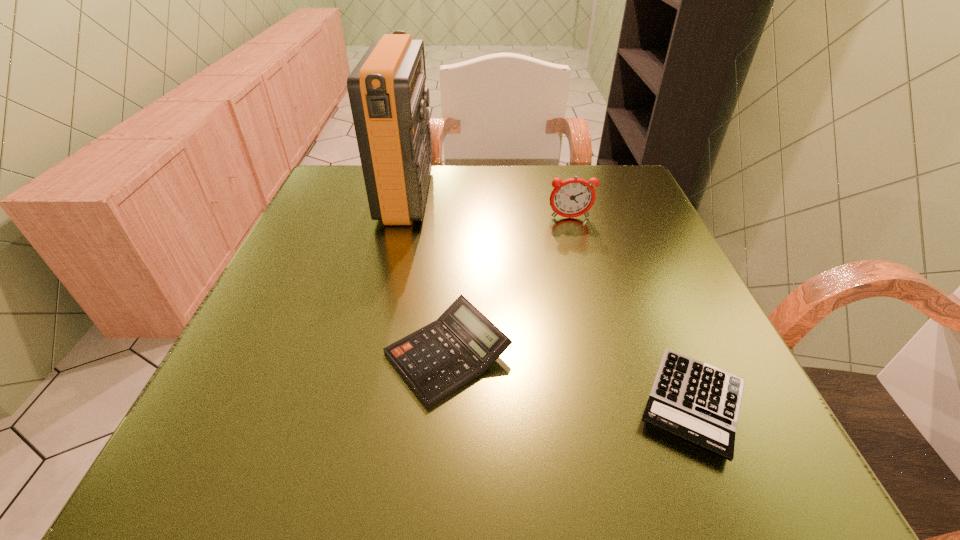
The image size is (960, 540). I want to click on radio receiver present at the far edge, so click(x=388, y=98).

Identify the location of alarm clock at the far edge. (573, 197).

I want to click on object that is at the near edge, so click(697, 402).

The image size is (960, 540). In order to click on object at the left edge in this screenshot , I will do `click(388, 98)`.

Locate an element on the screen. This screenshot has width=960, height=540. alarm clock that is at the right edge is located at coordinates (573, 197).

Identify the location of calculator positioned at the right edge. (697, 402).

At what (x,y) coordinates should I click in order to perform the action: click on object located in the far left corner section of the desktop. Please return your answer as a coordinate pair (x, y). The image size is (960, 540). Looking at the image, I should click on (388, 98).

Image resolution: width=960 pixels, height=540 pixels. Identify the location of object at the far right corner. (573, 197).

Image resolution: width=960 pixels, height=540 pixels. In order to click on object positioned at the near right corner in this screenshot , I will do `click(697, 402)`.

At what (x,y) coordinates should I click in order to perform the action: click on vacant space at the far edge. Please return your answer as a coordinate pair (x, y). The image size is (960, 540). Looking at the image, I should click on (440, 166).